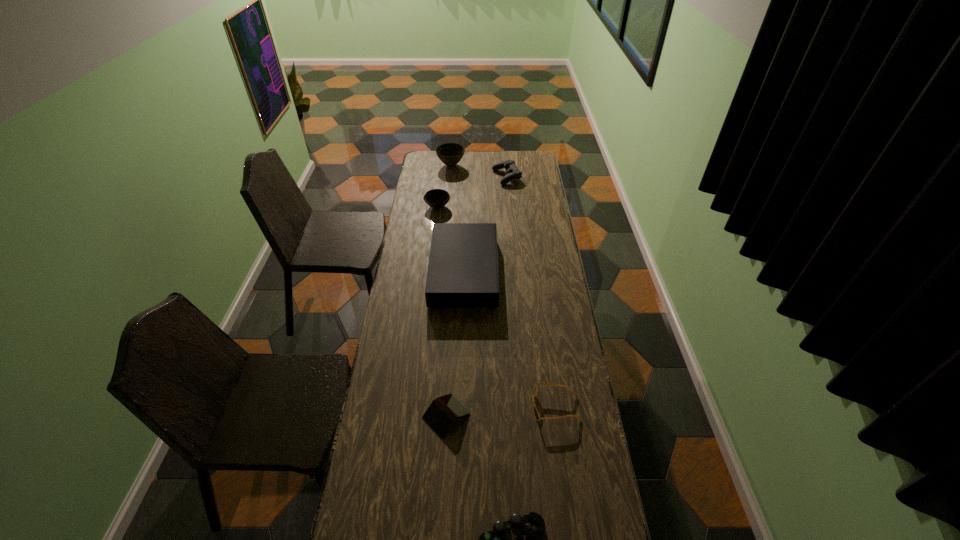
In order to click on the farther bowl in this screenshot , I will do `click(450, 154)`.

The image size is (960, 540). What are the coordinates of `CD player` in the screenshot? It's located at (462, 271).

Image resolution: width=960 pixels, height=540 pixels. What are the coordinates of `the farther control` in the screenshot? It's located at pos(513,173).

I want to click on the third farthest object, so click(436, 198).

You are a GUI agent. You are given a task and a screenshot of the screen. Output one action in this format:
    pyautogui.click(x=<x>, y=<y>)
    Task: Click on the nearer bowl
    
    Given the screenshot: What is the action you would take?
    pyautogui.click(x=436, y=198)

Locate an element on the screen. Image resolution: width=960 pixels, height=540 pixels. sunglasses is located at coordinates [x=536, y=414].

Identify the location of book. This screenshot has height=540, width=960. coord(443,411).

In order to click on free region located on the front of the farther bowl in this screenshot , I will do `click(449, 180)`.

You are a GUI agent. You are given a task and a screenshot of the screen. Output one action in this format:
    pyautogui.click(x=<x>, y=<y>)
    Task: Click on the vacant space positioned at the front of the fourth nearest object for disc insertion
    The width and height of the screenshot is (960, 540).
    Given the screenshot: What is the action you would take?
    pyautogui.click(x=533, y=271)

This screenshot has height=540, width=960. I want to click on vacant space located 0.220m on the left of the farther control, so click(454, 177).